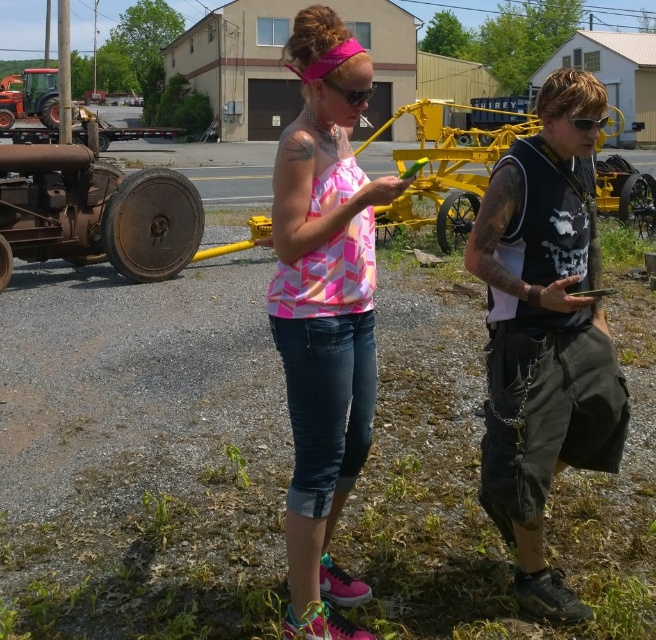
You are designing a storage box for two items, the pink printed tank top at center and the pink rubber goggles at center. Which item requires a wider storage compartment?

The pink rubber goggles at center requires a wider storage compartment because it is thicker than the pink printed tank top at center.

You are a photographer trying to capture a closeup of the pink rubber goggles at center. You are currently focusing on the pink printed tank top at center. Do you need to adjust your camera upwards or downwards to get the goggles into focus?

The pink printed tank top at center is located below the pink rubber goggles at center, so you need to adjust your camera upwards to focus on the pink rubber goggles at center.

You are a photographer trying to capture both the pink printed tank top at center and the pink rubber goggles at center in a single frame. Which object should you focus on first if you want to ensure both are in focus?

The pink printed tank top at center is not as tall as the pink rubber goggles at center, so you should focus on the pink rubber goggles at center first since it is taller and will require more depth of field to capture clearly.